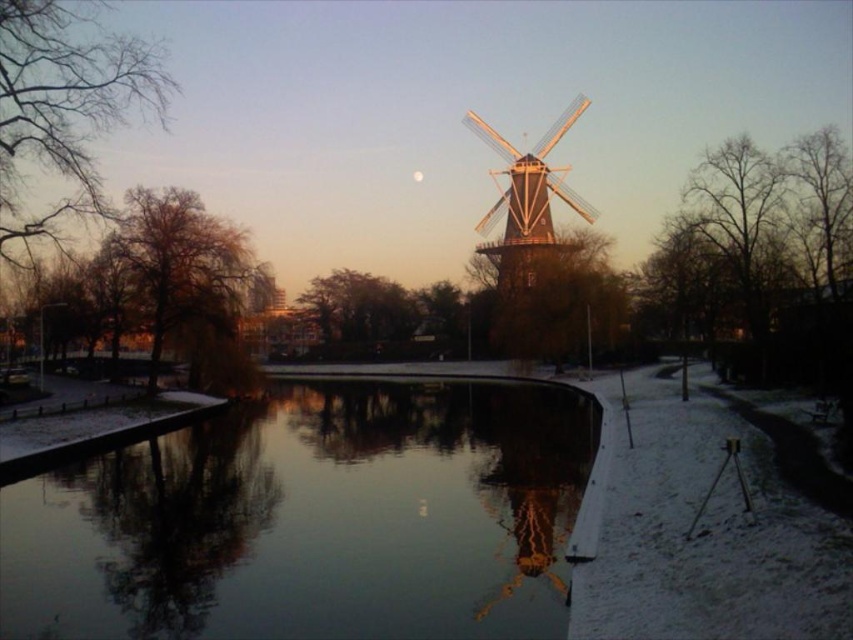
Who is more forward, [283,403] or [511,266]?

Point [283,403]

Can you confirm if smooth water at center is thinner than wooden windmill at center?

Incorrect, smooth water at center's width is not less than wooden windmill at center's.

What do you see at coordinates (312, 518) in the screenshot? The height and width of the screenshot is (640, 853). I see `smooth water at center` at bounding box center [312, 518].

Where is `smooth water at center`? The height and width of the screenshot is (640, 853). smooth water at center is located at coordinates (312, 518).